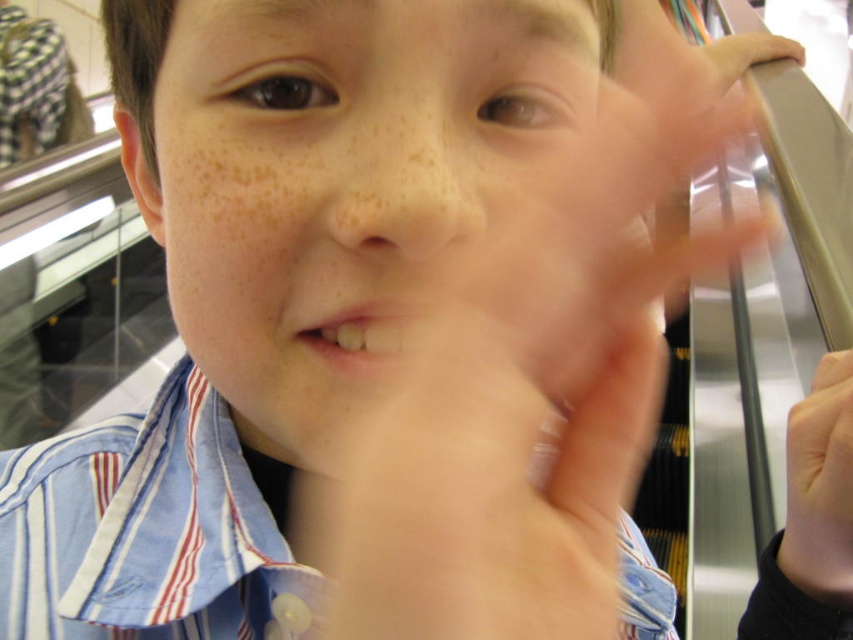
Question: Is smooth skin face at center behind blue striped shirt at center?

Choices:
 (A) no
 (B) yes

Answer: (A)

Question: Is smooth skin face at center below blue striped shirt at center?

Choices:
 (A) yes
 (B) no

Answer: (B)

Question: Is smooth skin face at center bigger than blue striped shirt at center?

Choices:
 (A) no
 (B) yes

Answer: (A)

Question: Estimate the real-world distances between objects in this image. Which object is farther from the smooth skin hand at lower right?

Choices:
 (A) blue striped shirt at center
 (B) smooth skin face at center

Answer: (B)

Question: Which object is farther from the camera taking this photo?

Choices:
 (A) smooth skin face at center
 (B) blue striped shirt at center

Answer: (B)

Question: Which point appears farthest from the camera in this image?

Choices:
 (A) (358, 348)
 (B) (646, 625)

Answer: (B)